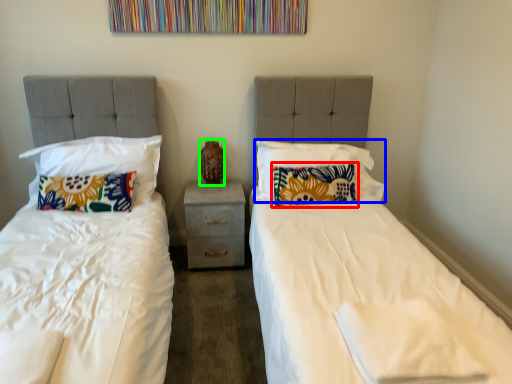
Question: Based on their relative distances, which object is nearer to pillow (highlighted by a red box)? Choose from pillow (highlighted by a blue box) and vase (highlighted by a green box).

Choices:
 (A) pillow
 (B) vase

Answer: (A)